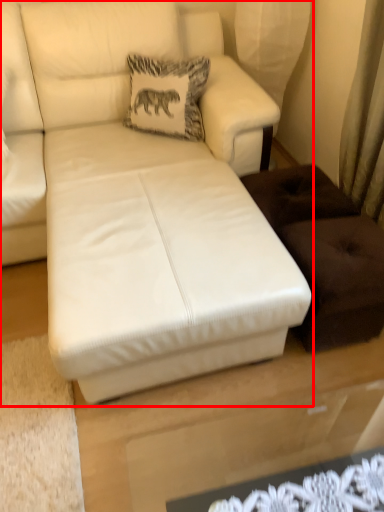
Question: From the image's perspective, considering the relative positions of studio couch (annotated by the red box) and pillow in the image provided, where is studio couch (annotated by the red box) located with respect to the staircase?

Choices:
 (A) below
 (B) above

Answer: (A)